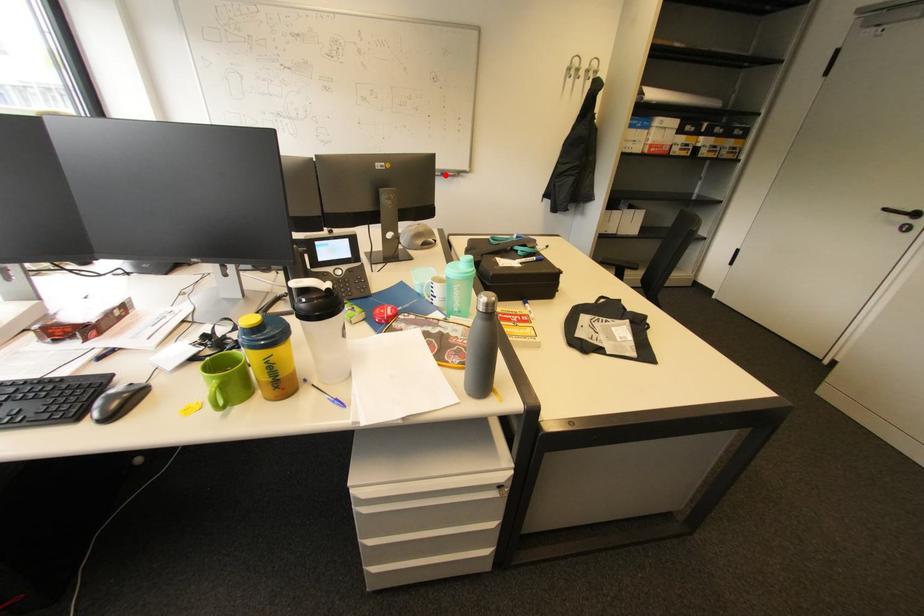
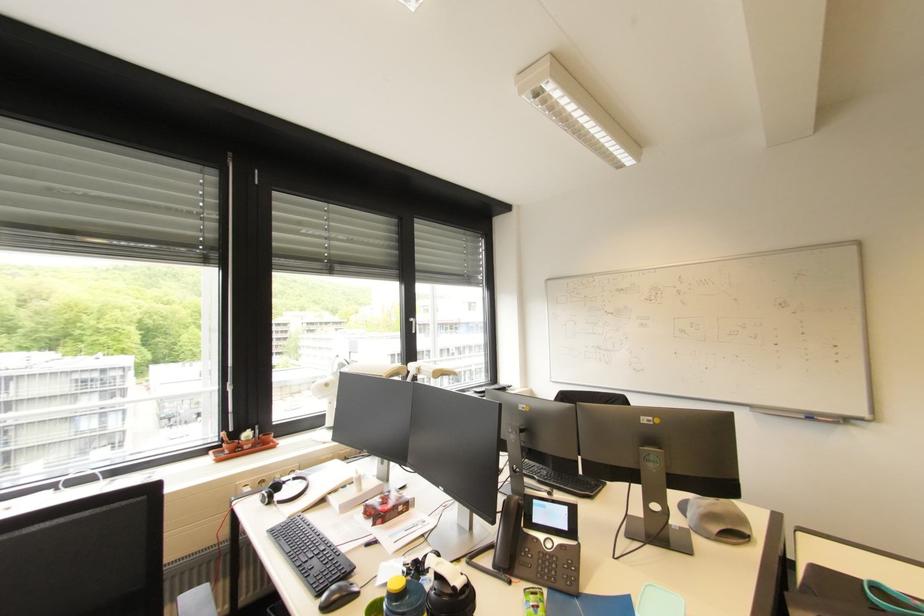
Question: A red point is marked in image1. In image2, is the corresponding 3D point closer to the camera or farther? Reply with the corresponding letter.

Choices:
 (A) The corresponding 3D point is closer.
 (B) The corresponding 3D point is farther.

Answer: (A)